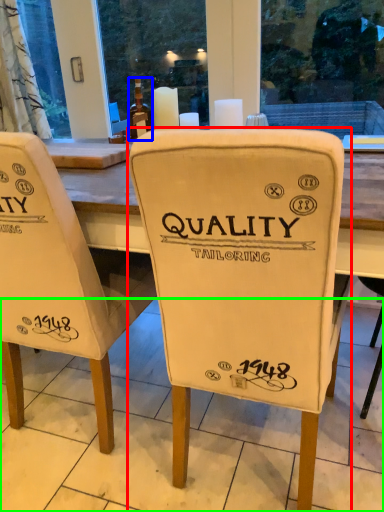
Question: Based on their relative distances, which object is farther from chair (highlighted by a red box)? Choose from bottle (highlighted by a blue box) and tile (highlighted by a green box).

Choices:
 (A) bottle
 (B) tile

Answer: (A)